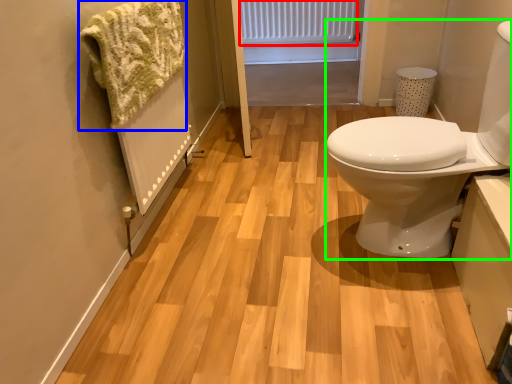
Question: Estimate the real-world distances between objects in this image. Which object is farther from radiator (highlighted by a red box), bath towel (highlighted by a blue box) or sink (highlighted by a green box)?

Choices:
 (A) bath towel
 (B) sink

Answer: (B)